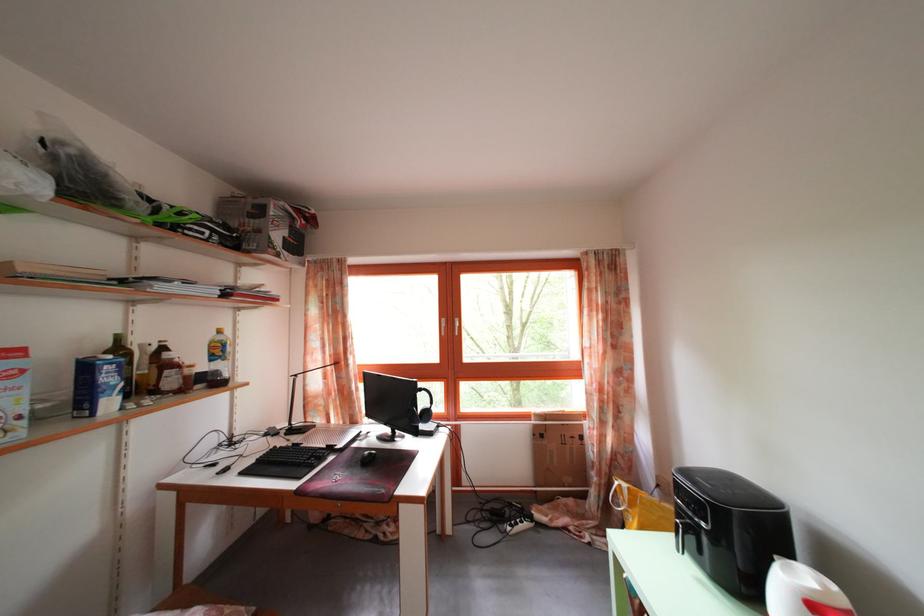
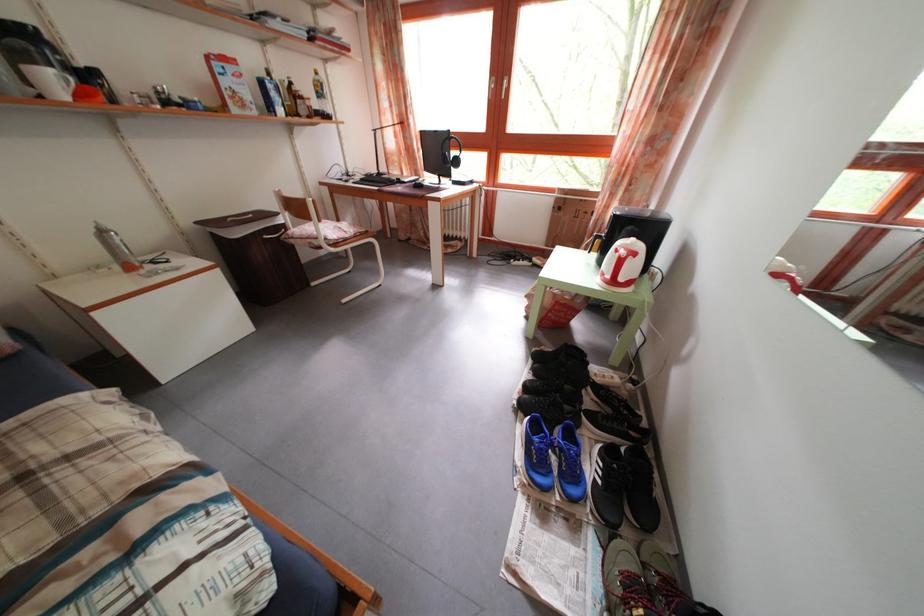
The point at (226,339) is marked in the first image. Where is the corresponding point in the second image?

(323, 79)